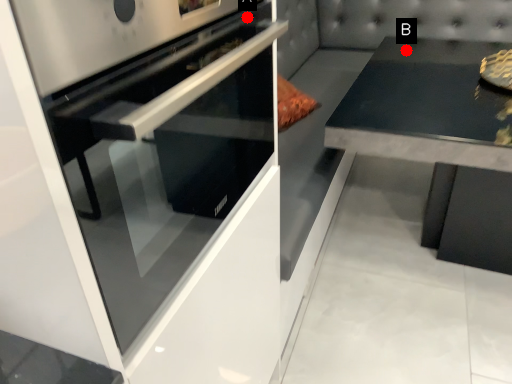
Question: Two points are circled on the image, labeled by A and B beside each circle. Which point is closer to the camera taking this photo?

Choices:
 (A) A is closer
 (B) B is closer

Answer: (A)